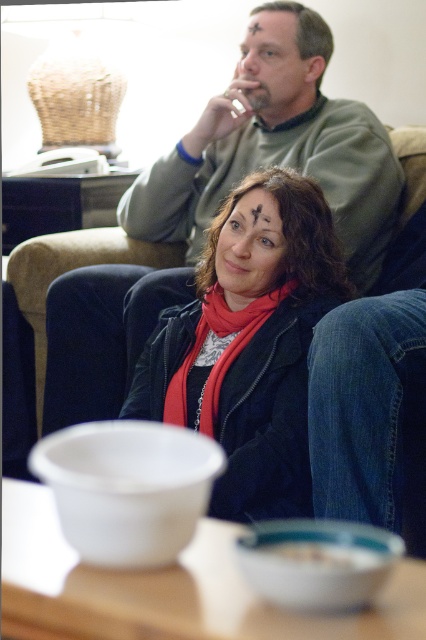
Who is positioned more to the right, matte green sweater at center or red matte scarf at center?

Positioned to the right is matte green sweater at center.

Who is positioned more to the left, matte green sweater at center or red matte scarf at center?

red matte scarf at center

Locate an element on the screen. The height and width of the screenshot is (640, 426). matte green sweater at center is located at coordinates (221, 204).

From the picture: Is matte green sweater at center taller than matte black jacket at center?

Yes.

This screenshot has height=640, width=426. In order to click on matte green sweater at center in this screenshot , I will do [x=221, y=204].

Does matte black jacket at center have a lesser width compared to red matte scarf at center?

No.

Is point (210, 257) positioned before point (233, 344)?

No, (210, 257) is behind (233, 344).

Identify the location of matte black jacket at center. (250, 342).